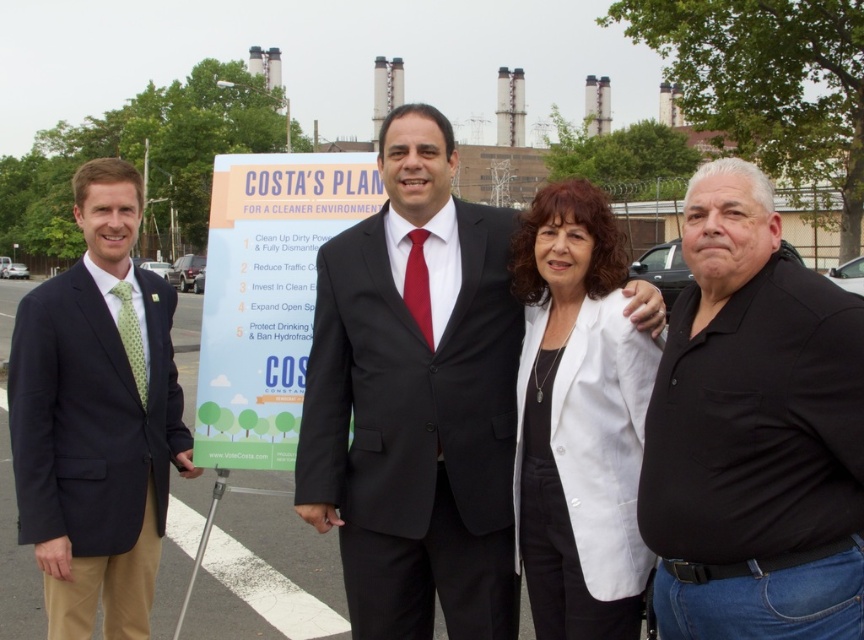
Question: Based on their relative distances, which object is nearer to the matte black suit at center?

Choices:
 (A) matte green tie at left
 (B) white matte blazer at center

Answer: (B)

Question: Based on their relative distances, which object is farther from the matte green tie at left?

Choices:
 (A) white paper sign at center
 (B) white matte blazer at center
 (C) black cotton polo shirt at right
 (D) matte black suit at center

Answer: (C)

Question: Can you confirm if black cotton polo shirt at right is smaller than matte green tie at left?

Choices:
 (A) yes
 (B) no

Answer: (A)

Question: Does matte black suit at center have a lesser width compared to matte green tie at left?

Choices:
 (A) yes
 (B) no

Answer: (A)

Question: Which point is closer to the camera?

Choices:
 (A) (785, 422)
 (B) (77, 420)

Answer: (A)

Question: Does white matte blazer at center appear on the right side of white paper sign at center?

Choices:
 (A) no
 (B) yes

Answer: (B)